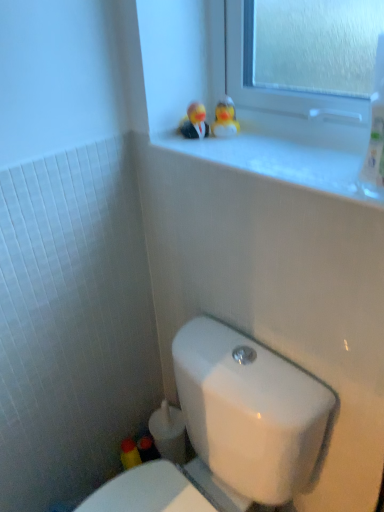
Question: Would you say white glossy window sill at upper center contains rubber duck at upper center, placed as the 1th miniature when sorted from left to right?

Choices:
 (A) no
 (B) yes

Answer: (A)

Question: Is white glossy window sill at upper center in contact with rubber duck at upper center, the second miniature from the right?

Choices:
 (A) no
 (B) yes

Answer: (A)

Question: Is white glossy window sill at upper center further to camera compared to rubber duck at upper center, the second miniature from the right?

Choices:
 (A) no
 (B) yes

Answer: (A)

Question: From the image's perspective, is white glossy window sill at upper center on top of rubber duck at upper center, placed as the 1th miniature when sorted from left to right?

Choices:
 (A) no
 (B) yes

Answer: (A)

Question: Is white glossy window sill at upper center positioned with its back to rubber duck at upper center, placed as the 1th miniature when sorted from left to right?

Choices:
 (A) no
 (B) yes

Answer: (A)

Question: Is point (241, 351) closer or farther from the camera than point (311, 169)?

Choices:
 (A) closer
 (B) farther

Answer: (B)

Question: Relative to white glossy window sill at upper center, is white glossy toilet at lower center in front or behind?

Choices:
 (A) behind
 (B) front

Answer: (B)

Question: From a real-world perspective, is white glossy toilet at lower center physically located above or below white glossy window sill at upper center?

Choices:
 (A) below
 (B) above

Answer: (A)

Question: Is white glossy toilet at lower center bigger or smaller than white glossy window sill at upper center?

Choices:
 (A) small
 (B) big

Answer: (B)

Question: Considering their positions, is rubber duckies at upper center, which is the first miniature in right-to-left order, located in front of or behind rubber duck at upper center, placed as the 1th miniature when sorted from left to right?

Choices:
 (A) front
 (B) behind

Answer: (B)

Question: In terms of width, does rubber duckies at upper center, the 2th miniature when ordered from left to right, look wider or thinner when compared to rubber duck at upper center, the second miniature from the right?

Choices:
 (A) wide
 (B) thin

Answer: (A)

Question: Does point (235, 132) appear closer or farther from the camera than point (198, 121)?

Choices:
 (A) closer
 (B) farther

Answer: (B)

Question: In the image, is rubber duckies at upper center, the 2th miniature when ordered from left to right, on the left side or the right side of rubber duck at upper center, the second miniature from the right?

Choices:
 (A) left
 (B) right

Answer: (B)

Question: From a real-world perspective, is rubber duck at upper center, the second miniature from the right, physically located above or below rubber duckies at upper center, the 2th miniature when ordered from left to right?

Choices:
 (A) below
 (B) above

Answer: (A)

Question: Considering the positions of rubber duck at upper center, the second miniature from the right, and rubber duckies at upper center, which is the first miniature in right-to-left order, in the image, is rubber duck at upper center, the second miniature from the right, bigger or smaller than rubber duckies at upper center, which is the first miniature in right-to-left order,?

Choices:
 (A) big
 (B) small

Answer: (B)